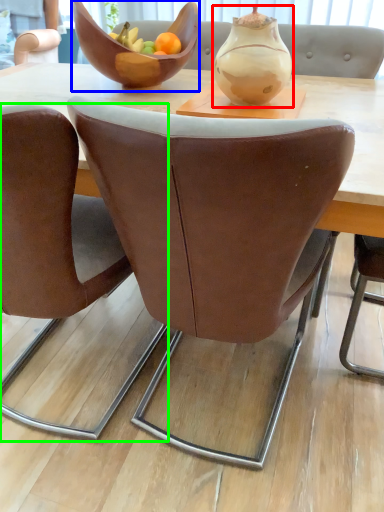
Question: Which object is the closest to the vase (highlighted by a red box)? Choose among these: bowl (highlighted by a blue box) or chair (highlighted by a green box).

Choices:
 (A) bowl
 (B) chair

Answer: (A)